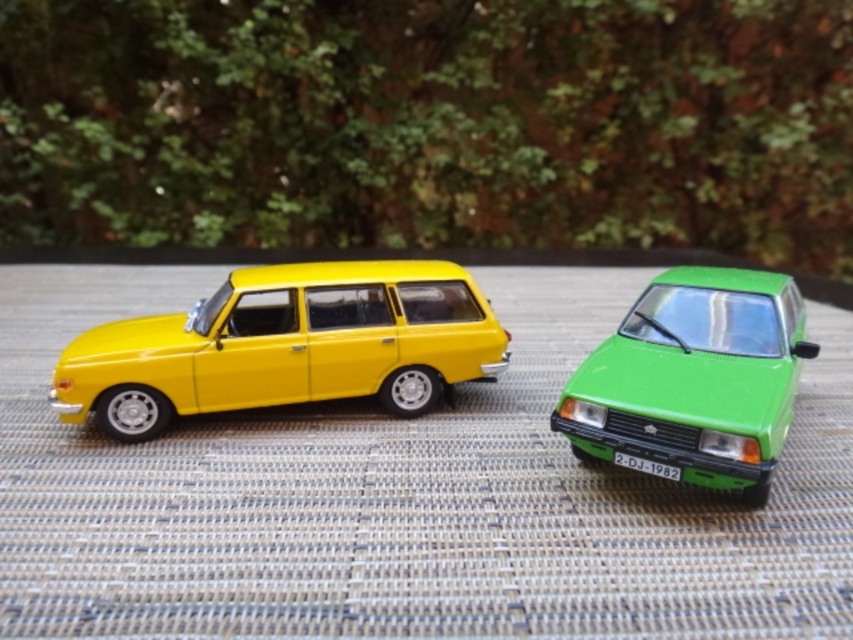
Describe the element at coordinates (286, 346) in the screenshot. I see `matte yellow station wagon at center` at that location.

I want to click on matte yellow station wagon at center, so click(286, 346).